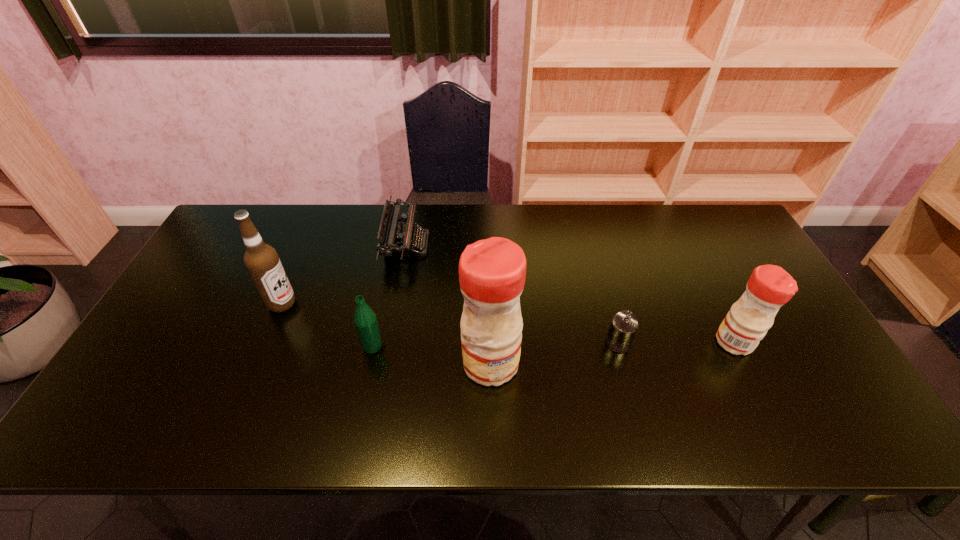
At what (x,y) coordinates should I click in order to perform the action: click on free point that keeps the condiments evenly spaced on the left. Please return your answer as a coordinate pair (x, y). The image size is (960, 540). Looking at the image, I should click on pos(226,386).